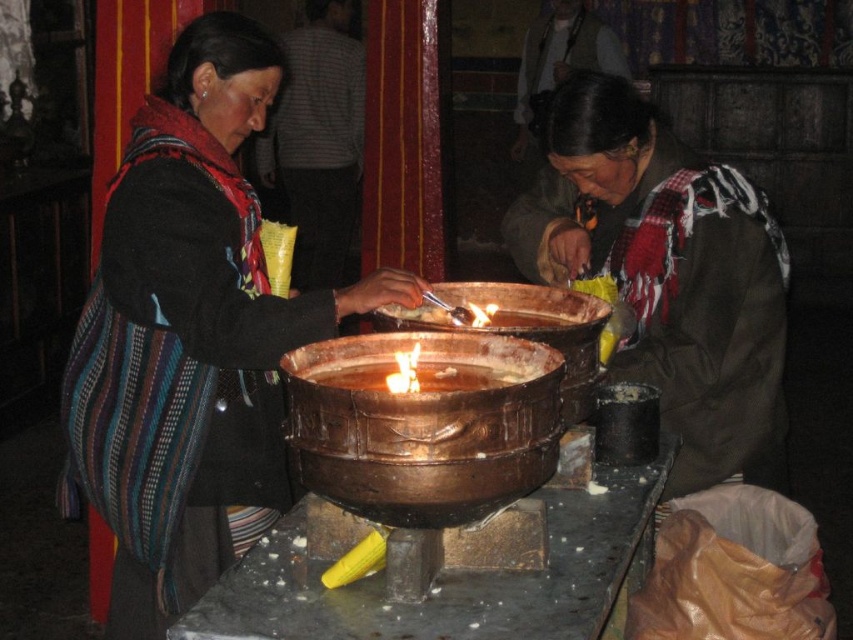
Consider the image. Which of these two, brown textured scarf at lower right or shiny metallic bowl at center, stands taller?

Standing taller between the two is brown textured scarf at lower right.

Does brown textured scarf at lower right appear over shiny metallic bowl at center?

Correct, brown textured scarf at lower right is located above shiny metallic bowl at center.

Does point (664, 140) come farther from viewer compared to point (398, 390)?

Yes, it is.

At what (x,y) coordinates should I click in order to perform the action: click on brown textured scarf at lower right. Please return your answer as a coordinate pair (x, y). Looking at the image, I should click on (666, 273).

Where is `matte black jacket at left`? matte black jacket at left is located at coordinates (190, 337).

Between point (257, 352) and point (299, 376), which one is positioned behind?

Positioned behind is point (257, 352).

Find the location of a particular element. matte black jacket at left is located at coordinates (190, 337).

Looking at this image, is matte black jacket at left shorter than brown textured scarf at lower right?

In fact, matte black jacket at left may be taller than brown textured scarf at lower right.

Who is higher up, matte black jacket at left or brown textured scarf at lower right?

brown textured scarf at lower right is above.

Is point (177, 474) more distant than point (770, 228)?

That is False.

In order to click on matte black jacket at left in this screenshot , I will do (190, 337).